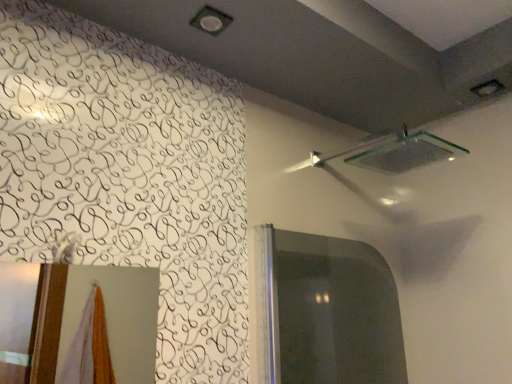
Locate an element on the screen. This screenshot has height=384, width=512. transparent glass screen door at lower right is located at coordinates (326, 312).

Image resolution: width=512 pixels, height=384 pixels. Describe the element at coordinates (326, 312) in the screenshot. I see `transparent glass screen door at lower right` at that location.

The height and width of the screenshot is (384, 512). I want to click on transparent glass screen door at lower right, so (326, 312).